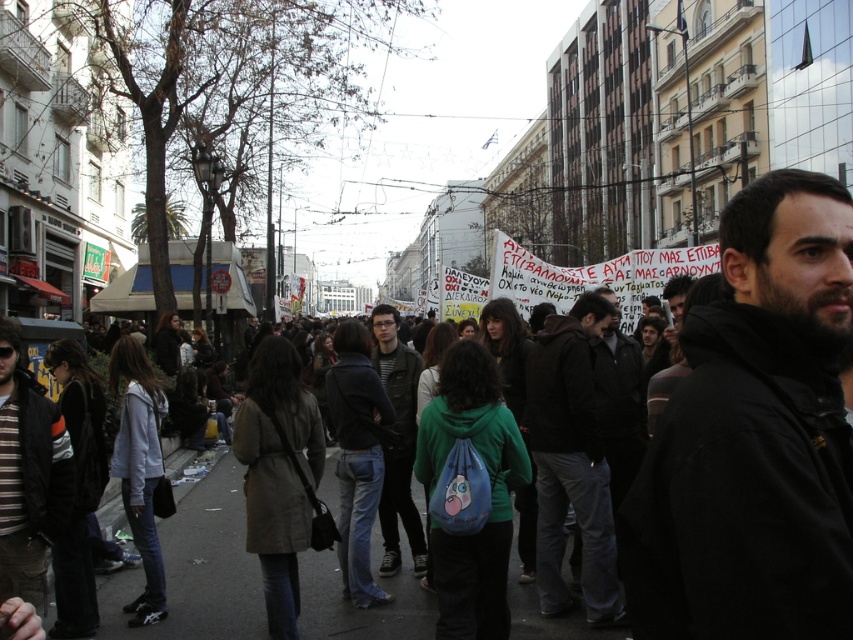
You are a photographer trying to capture a clear shot of both the black matte jacket at center and the dark green jacket at center in the crowd. Given their heights, which jacket will appear smaller in your photo?

The black matte jacket at center appears smaller in the photo because it is not as tall as the dark green jacket at center.

You are a photographer trying to capture a candid shot of the crowd. You notice the black matte jacket at center and dark gray pants at center. Which object is wider in the image?

The black matte jacket at center is wider than the dark gray pants at center.

You are a photographer positioned at the origin point of the coordinate system. You want to capture a photo of the black matte jacket at center. What are the coordinates where you should aim your camera?

The black matte jacket at center is located at coordinates point (755, 435), so you should aim your camera at those coordinates to capture it.